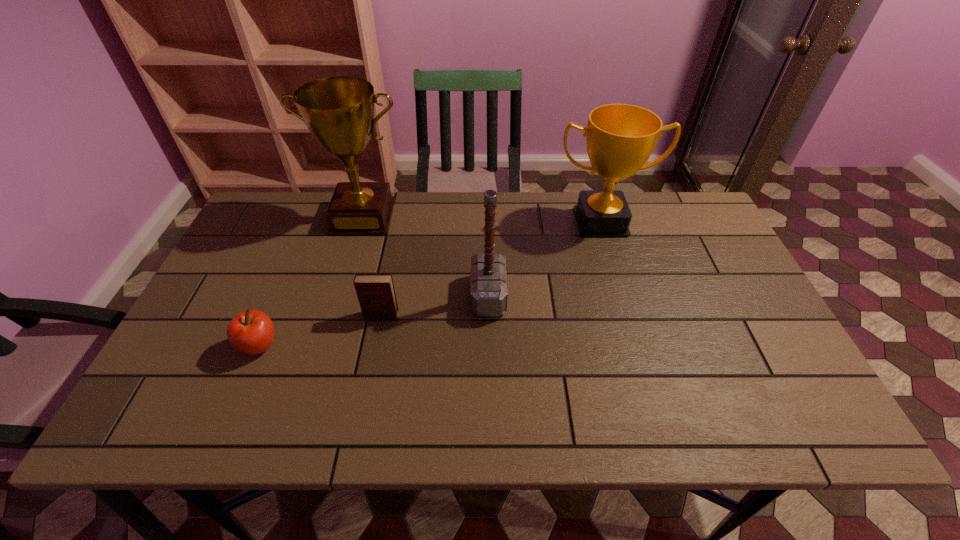
Find the location of a particular element. the tallest object is located at coordinates point(339,111).

The width and height of the screenshot is (960, 540). Find the location of `the taller award`. the taller award is located at coordinates (339, 111).

Identify the location of the shorter award. (620, 138).

You are a GUI agent. You are given a task and a screenshot of the screen. Output one action in this format:
    pyautogui.click(x=<x>, y=<y>)
    Task: Click on the rightmost object
    
    Given the screenshot: What is the action you would take?
    pyautogui.click(x=620, y=138)

This screenshot has height=540, width=960. I want to click on the fourth object from left to right, so click(x=489, y=289).

Where is `diary`? The image size is (960, 540). diary is located at coordinates 376,294.

In order to click on apple in this screenshot , I will do `click(252, 332)`.

The width and height of the screenshot is (960, 540). In order to click on vacant space located on the plaque of the tallest object in this screenshot , I will do `click(342, 289)`.

Where is `free space located 0.210m on the front-facing side of the rightmost object`? free space located 0.210m on the front-facing side of the rightmost object is located at coordinates (622, 294).

The height and width of the screenshot is (540, 960). What are the coordinates of `vacant space situated 0.140m on the striking surface of the fourth object from left to right` in the screenshot? It's located at (419, 296).